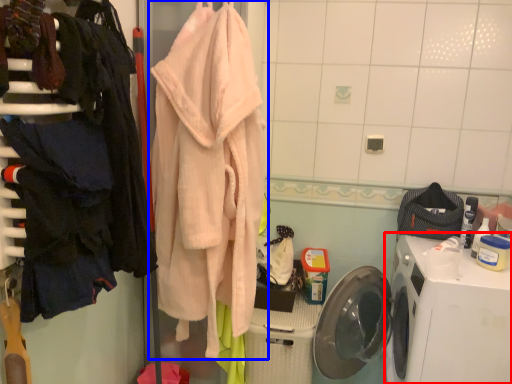
Question: Which point is further to the camera, washing machine (highlighted by a red box) or towel (highlighted by a blue box)?

Choices:
 (A) washing machine
 (B) towel

Answer: (A)